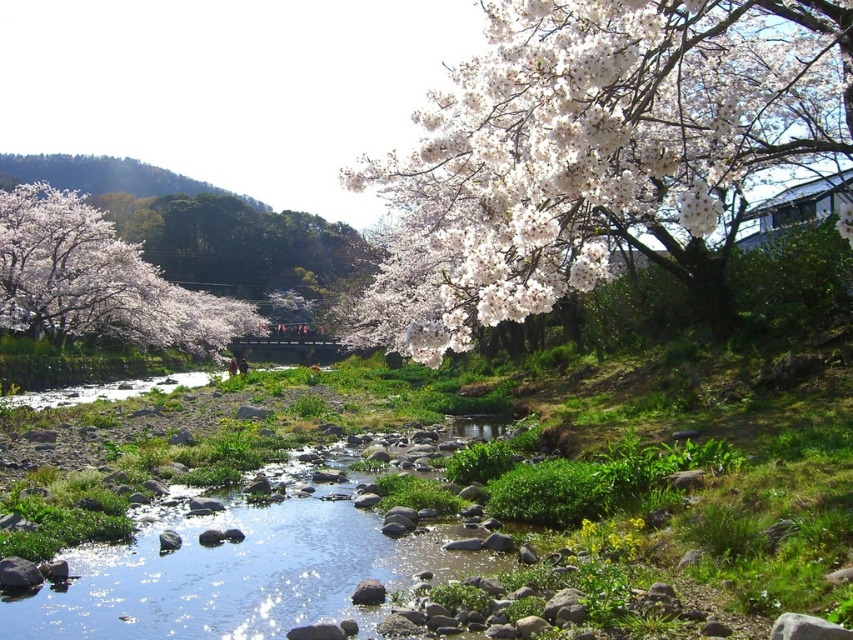
Who is positioned more to the left, white matte flower at upper right or clear water at center?

Positioned to the left is clear water at center.

Does white matte flower at upper right appear on the left side of clear water at center?

Incorrect, white matte flower at upper right is not on the left side of clear water at center.

I want to click on white matte flower at upper right, so click(601, 152).

Consider the image. Does white matte flower at upper right have a larger size compared to white matte blossoms at left?

Yes.

Can you confirm if white matte flower at upper right is positioned to the right of white matte blossoms at left?

Indeed, white matte flower at upper right is positioned on the right side of white matte blossoms at left.

In order to click on white matte flower at upper right in this screenshot , I will do `click(601, 152)`.

You are a GUI agent. You are given a task and a screenshot of the screen. Output one action in this format:
    pyautogui.click(x=<x>, y=<y>)
    Task: Click on the white matte flower at upper right
    This screenshot has width=853, height=640.
    Given the screenshot: What is the action you would take?
    pyautogui.click(x=601, y=152)

Who is positioned more to the left, clear water at center or white matte blossoms at left?

Positioned to the left is white matte blossoms at left.

Is point (215, 566) closer to viewer compared to point (19, 268)?

Yes.

At what (x,y) coordinates should I click in order to perform the action: click on clear water at center. Please return your answer as a coordinate pair (x, y). The image size is (853, 640). Looking at the image, I should click on (241, 572).

Locate an element on the screen. This screenshot has width=853, height=640. clear water at center is located at coordinates (241, 572).